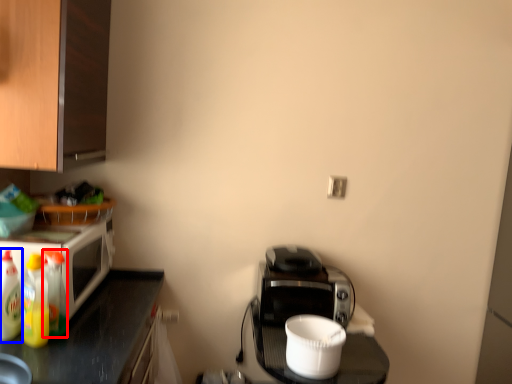
Question: Which of the following is the closest to the observer, bottle (highlighted by a red box) or bottle (highlighted by a blue box)?

Choices:
 (A) bottle
 (B) bottle

Answer: (B)